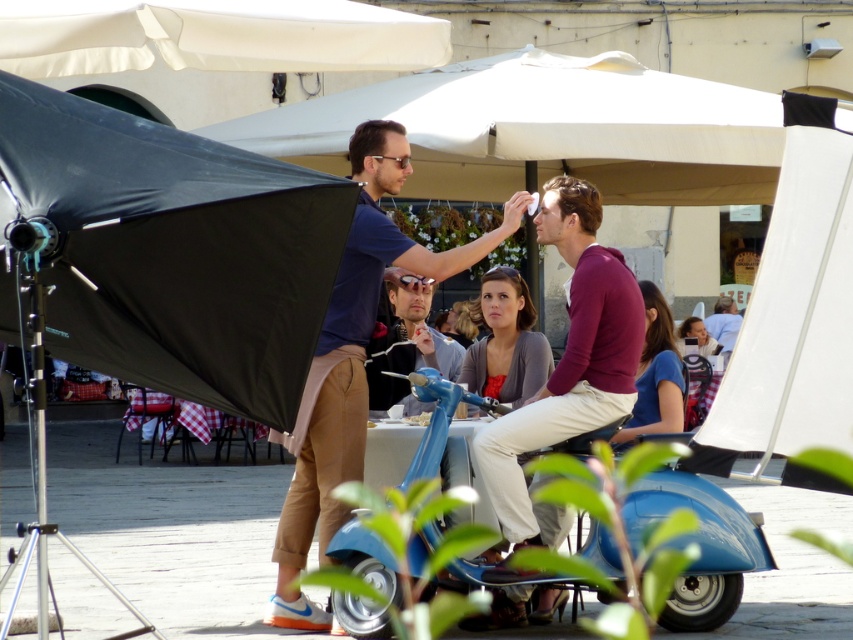
Consider the image. Is blue matte scooter at center positioned in front of blue cotton shirt at center?

Yes, blue matte scooter at center is in front of blue cotton shirt at center.

Does blue matte scooter at center have a lesser height compared to blue cotton shirt at center?

No.

This screenshot has width=853, height=640. Find the location of `blue matte scooter at center`. blue matte scooter at center is located at coordinates tap(352, 360).

How much distance is there between matte gray sweater at center and blue cotton shirt at center?

matte gray sweater at center is 34.81 inches from blue cotton shirt at center.

Can you confirm if matte gray sweater at center is shorter than blue cotton shirt at center?

Yes, matte gray sweater at center is shorter than blue cotton shirt at center.

Describe the element at coordinates (505, 340) in the screenshot. I see `matte gray sweater at center` at that location.

Where is `matte gray sweater at center`? matte gray sweater at center is located at coordinates (505, 340).

Can you confirm if black matte umbrella at left is positioned to the left of blue matte scooter at center?

Correct, you'll find black matte umbrella at left to the left of blue matte scooter at center.

Who is more forward, [78,218] or [378,221]?

Point [78,218]

At what (x,y) coordinates should I click in order to perform the action: click on black matte umbrella at left. Please return your answer as a coordinate pair (x, y). Looking at the image, I should click on (173, 250).